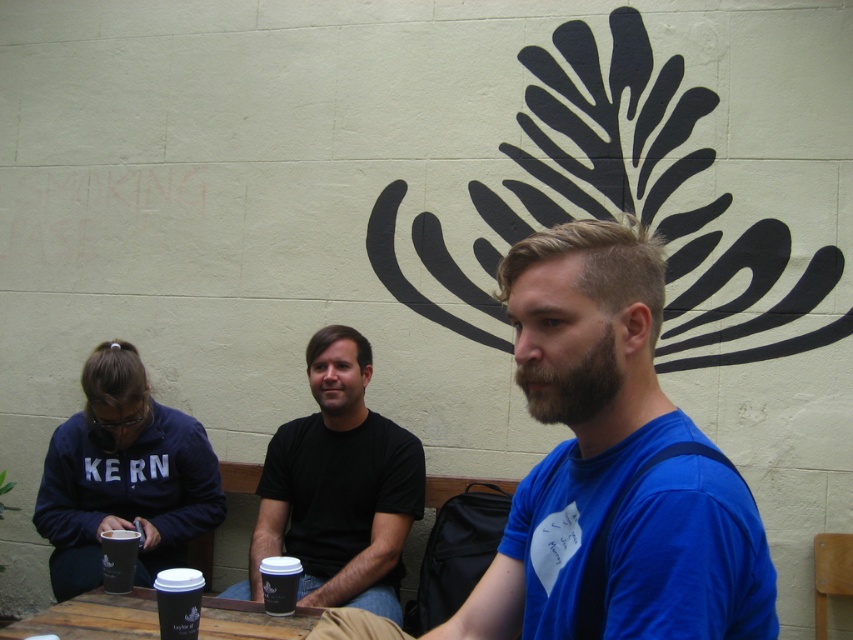
Is the position of black matte t-shirt at center less distant than that of black paper cup at lower left?

That is False.

Can you confirm if black matte t-shirt at center is taller than black paper cup at lower left?

Yes, black matte t-shirt at center is taller than black paper cup at lower left.

This screenshot has width=853, height=640. In order to click on black matte t-shirt at center in this screenshot , I will do `click(338, 488)`.

Locate an element on the screen. The image size is (853, 640). black matte t-shirt at center is located at coordinates (338, 488).

Which is behind, point (100, 544) or point (283, 609)?

The point (100, 544) is behind.

Find the location of `matte black cup at lower left`. matte black cup at lower left is located at coordinates (119, 560).

This screenshot has width=853, height=640. Describe the element at coordinates (93, 618) in the screenshot. I see `wooden table at center` at that location.

Does wooden table at center lie in front of black paper cup at lower left?

No, wooden table at center is further to the viewer.

Identify the location of wooden table at center. This screenshot has width=853, height=640. (93, 618).